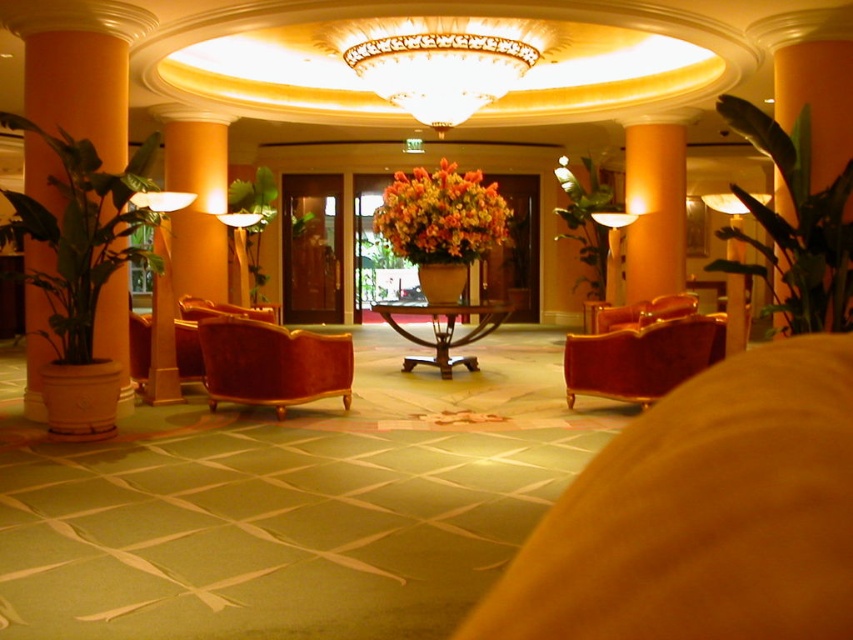
Does point (425, 65) lie behind point (619, 385)?

Yes, it is.

At what (x,y) coordinates should I click in order to perform the action: click on illuminated glass chandelier at upper center. Please return your answer as a coordinate pair (x, y). The width and height of the screenshot is (853, 640). Looking at the image, I should click on (439, 61).

Does illuminated glass chandelier at upper center have a larger size compared to matte gold lamp at upper center?

Actually, illuminated glass chandelier at upper center might be smaller than matte gold lamp at upper center.

Who is higher up, illuminated glass chandelier at upper center or matte gold lamp at upper center?

illuminated glass chandelier at upper center is higher up.

Is point (465, 35) positioned in front of point (734, 330)?

No, (465, 35) is behind (734, 330).

Image resolution: width=853 pixels, height=640 pixels. Identify the location of illuminated glass chandelier at upper center. (439, 61).

Does matte white lampshade at left have a lesser width compared to velvet red armchair at center?

Yes.

Measure the distance between matte white lampshade at left and camera.

matte white lampshade at left is 6.05 meters away from camera.

You are a GUI agent. You are given a task and a screenshot of the screen. Output one action in this format:
    pyautogui.click(x=<x>, y=<y>)
    Task: Click on the matte white lampshade at left
    This screenshot has height=640, width=853.
    Given the screenshot: What is the action you would take?
    pyautogui.click(x=161, y=300)